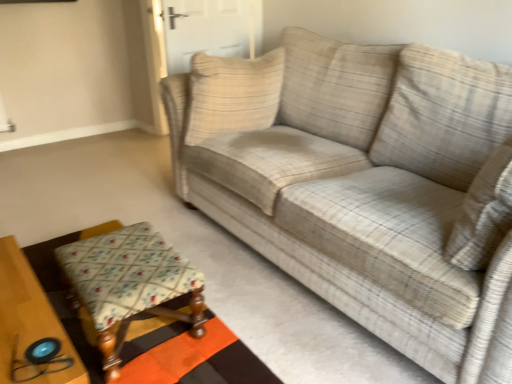
Question: Is white fabric door at center outside plaid fabric couch at center?

Choices:
 (A) yes
 (B) no

Answer: (A)

Question: Is white fabric door at center beside plaid fabric couch at center?

Choices:
 (A) no
 (B) yes

Answer: (A)

Question: Is white fabric door at center turned away from plaid fabric couch at center?

Choices:
 (A) no
 (B) yes

Answer: (B)

Question: Can you confirm if white fabric door at center is bigger than plaid fabric couch at center?

Choices:
 (A) yes
 (B) no

Answer: (B)

Question: Considering the relative sizes of white fabric door at center and plaid fabric couch at center in the image provided, is white fabric door at center smaller than plaid fabric couch at center?

Choices:
 (A) yes
 (B) no

Answer: (A)

Question: Is point (168, 296) closer or farther from the camera than point (159, 79)?

Choices:
 (A) farther
 (B) closer

Answer: (B)

Question: Considering their positions, is floral fabric stool at lower left located in front of or behind white fabric door at center?

Choices:
 (A) behind
 (B) front

Answer: (B)

Question: Looking at the image, does floral fabric stool at lower left seem bigger or smaller compared to white fabric door at center?

Choices:
 (A) small
 (B) big

Answer: (A)

Question: From a real-world perspective, is floral fabric stool at lower left physically located above or below white fabric door at center?

Choices:
 (A) above
 (B) below

Answer: (B)

Question: Is wooden table at lower left spatially inside beige textured pillow at center, or outside of it?

Choices:
 (A) inside
 (B) outside

Answer: (B)

Question: In the image, is wooden table at lower left on the left side or the right side of beige textured pillow at center?

Choices:
 (A) right
 (B) left

Answer: (B)

Question: In terms of height, does wooden table at lower left look taller or shorter compared to beige textured pillow at center?

Choices:
 (A) short
 (B) tall

Answer: (A)

Question: From a real-world perspective, is wooden table at lower left positioned above or below beige textured pillow at center?

Choices:
 (A) above
 (B) below

Answer: (B)

Question: From a real-world perspective, is white fabric door at center above or below floral fabric stool at lower left?

Choices:
 (A) above
 (B) below

Answer: (A)

Question: Is white fabric door at center bigger or smaller than floral fabric stool at lower left?

Choices:
 (A) small
 (B) big

Answer: (B)